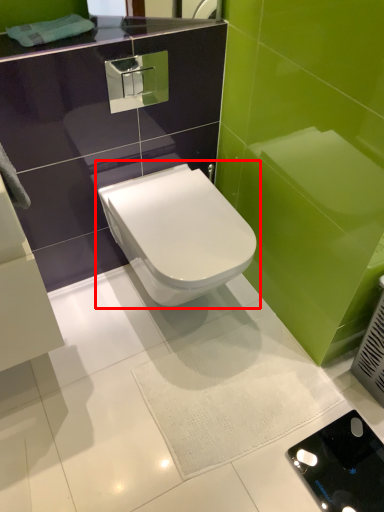
Question: Considering the relative positions of toilet (annotated by the red box) and porcelain in the image provided, where is toilet (annotated by the red box) located with respect to the staircase?

Choices:
 (A) left
 (B) right

Answer: (A)